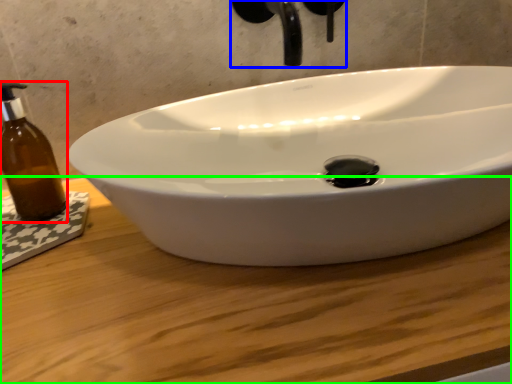
Question: Based on their relative distances, which object is farther from bottle (highlighted by a red box)? Choose from plumbing fixture (highlighted by a blue box) and counter top (highlighted by a green box).

Choices:
 (A) plumbing fixture
 (B) counter top

Answer: (A)